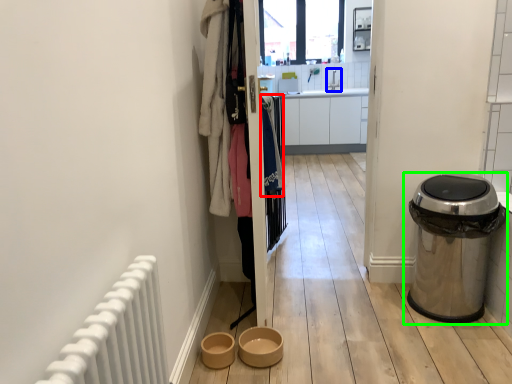
Question: Which object is positioned closest to clothing (highlighted by a red box)? Select from sink (highlighted by a blue box) and waste container (highlighted by a green box).

Choices:
 (A) sink
 (B) waste container

Answer: (B)